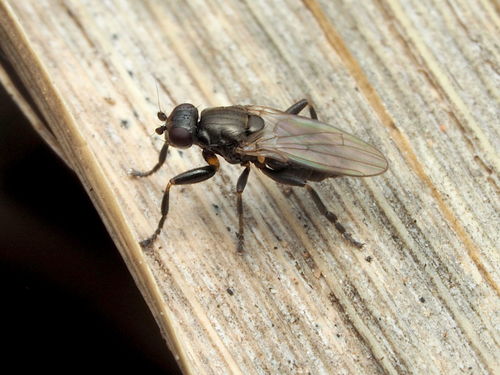
Image resolution: width=500 pixels, height=375 pixels. In order to click on wood platform in this screenshot , I will do `click(92, 55)`.